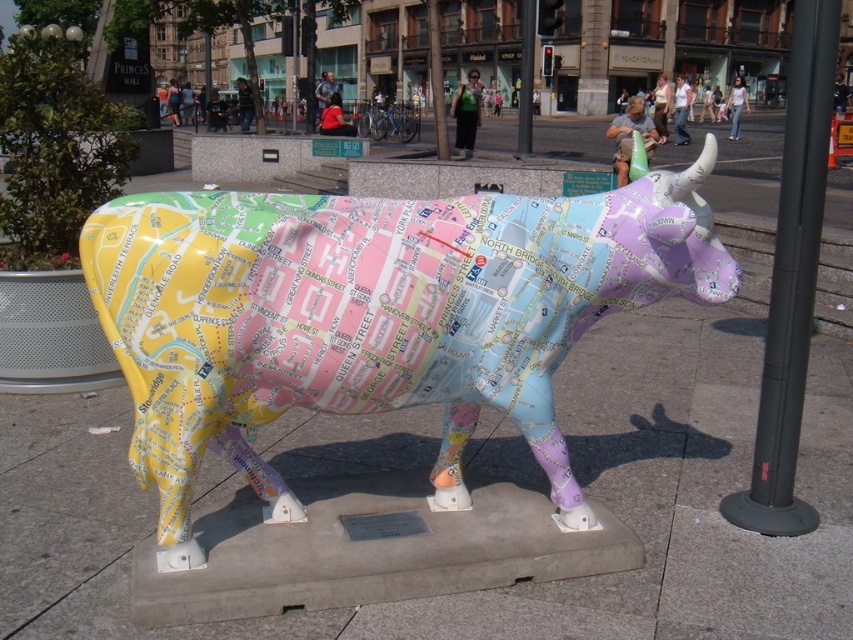
You are standing in front of the cow sculpture and see two points marked on it. The first point is at location point (161,353) and the second is at point (781,369). Which point is closer to you?

Point (161,353) is in front of point (781,369), so it is closer to you.